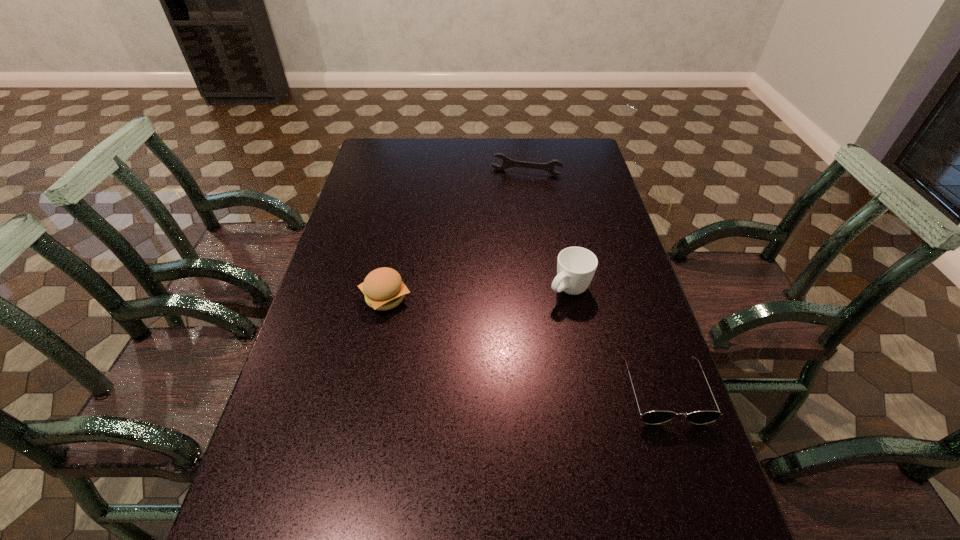
Locate an element on the screen. vacant space at the far edge of the desktop is located at coordinates (461, 156).

The width and height of the screenshot is (960, 540). Find the location of `free space at the left edge`. free space at the left edge is located at coordinates (359, 193).

The height and width of the screenshot is (540, 960). I want to click on vacant space at the right edge of the desktop, so click(x=590, y=194).

At what (x,y) coordinates should I click in order to perform the action: click on free space at the far left corner of the desktop. Please return your answer as a coordinate pair (x, y). Image resolution: width=960 pixels, height=540 pixels. Looking at the image, I should click on 371,160.

Where is `free space between the sunglasses and the cup`? The image size is (960, 540). free space between the sunglasses and the cup is located at coordinates (617, 340).

The width and height of the screenshot is (960, 540). Find the location of `free space between the farthest object and the cup`. free space between the farthest object and the cup is located at coordinates (547, 231).

In order to click on empty space between the rightmost object and the hamburger in this screenshot , I will do `click(525, 345)`.

You are a GUI agent. You are given a task and a screenshot of the screen. Output one action in this format:
    pyautogui.click(x=<x>, y=<y>)
    Task: Click on the free area in between the cup and the rightmost object
    Image resolution: width=960 pixels, height=540 pixels.
    Given the screenshot: What is the action you would take?
    pyautogui.click(x=617, y=340)

You are a GUI agent. You are given a task and a screenshot of the screen. Output one action in this format:
    pyautogui.click(x=<x>, y=<y>)
    Task: Click on the vacant area that lies between the farthest object and the hamburger
    The height and width of the screenshot is (540, 960).
    Given the screenshot: What is the action you would take?
    coord(456,235)

Locate an element on the screen. blank region between the rightmost object and the hamburger is located at coordinates (525, 345).